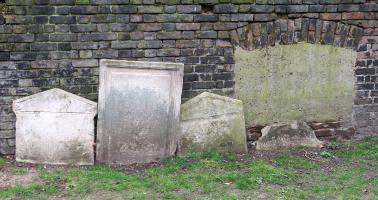
Locate an element on the screen. The width and height of the screenshot is (378, 200). 1 hole on left side of wall is located at coordinates (208, 9).